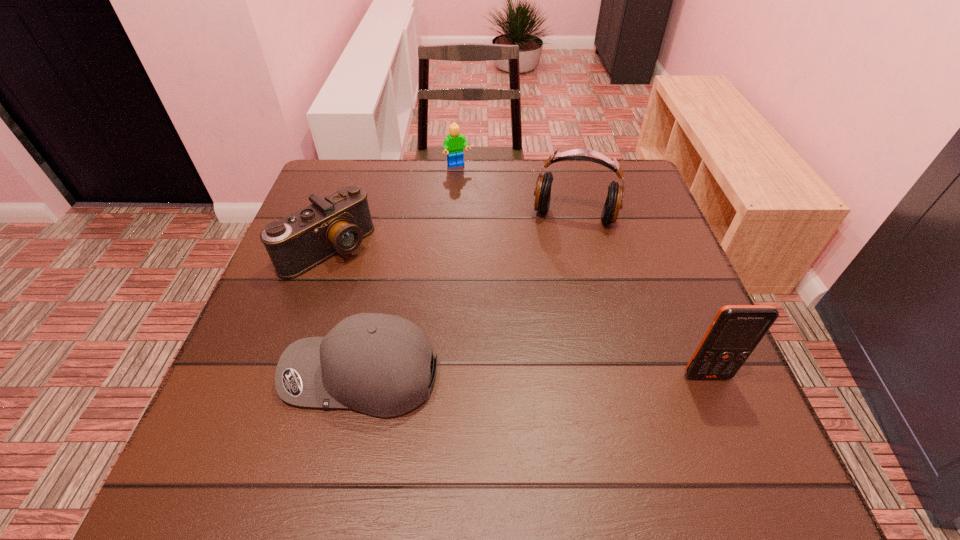
Where is `free space on the desktop that is between the baseball cap and the rightmost object and is positioned on the ear cups of the fourth object from left to right`? free space on the desktop that is between the baseball cap and the rightmost object and is positioned on the ear cups of the fourth object from left to right is located at coordinates (543, 375).

This screenshot has height=540, width=960. In order to click on vacant space on the desktop that is between the baseball cap and the rightmost object and is positioned on the lens of the camera in this screenshot , I will do `click(483, 375)`.

Find the location of `vacant space on the desktop that is between the baseball cap and the cellular telephone and is positioned on the face of the Lego`. vacant space on the desktop that is between the baseball cap and the cellular telephone and is positioned on the face of the Lego is located at coordinates (571, 376).